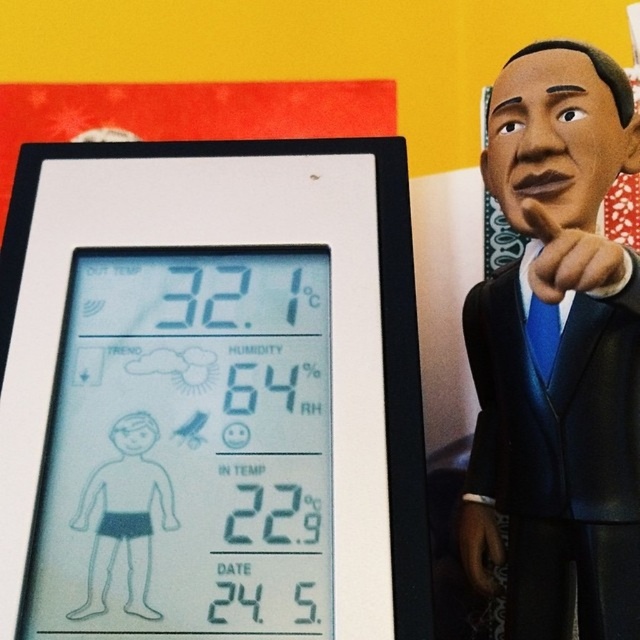
Can you confirm if transparent plastic thermometer at center is smaller than white matte figure at center?

Incorrect, transparent plastic thermometer at center is not smaller in size than white matte figure at center.

Is transparent plastic thermometer at center further to camera compared to white matte figure at center?

No, it is not.

The image size is (640, 640). I want to click on transparent plastic thermometer at center, so click(211, 392).

Is transparent plastic thermometer at center closer to the viewer compared to black glossy figurine at right?

No, transparent plastic thermometer at center is further to the viewer.

Who is more forward, (348,634) or (563,579)?

Point (348,634) is in front.

Find the location of a particular element. This screenshot has width=640, height=640. transparent plastic thermometer at center is located at coordinates (211, 392).

Between black glossy figurine at right and white matte figure at center, which one appears on the left side from the viewer's perspective?

white matte figure at center is more to the left.

Based on the photo, can you confirm if black glossy figurine at right is positioned to the right of white matte figure at center?

Indeed, black glossy figurine at right is positioned on the right side of white matte figure at center.

Is point (570, 70) positioned behind point (113, 467)?

Yes, it is behind point (113, 467).

I want to click on black glossy figurine at right, so click(557, 355).